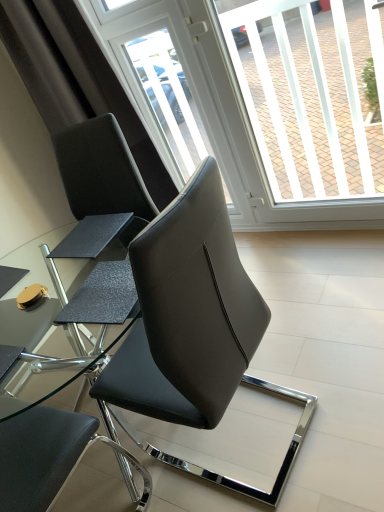
Identify the location of free region on the left part of transparent glass window screen at upper center. Image resolution: width=384 pixels, height=512 pixels. (288, 265).